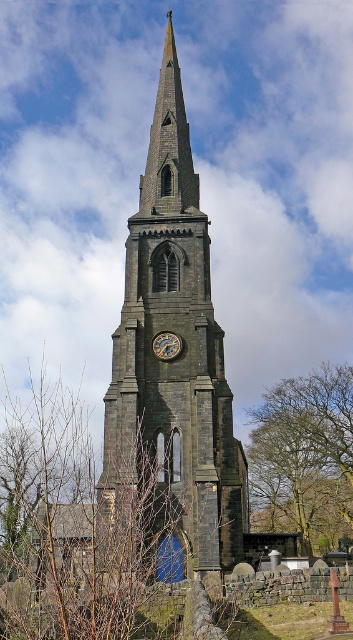
You are standing in front of the Gothic church tower and want to determine the relative positions of two points marked on the tower. Which point is closer to you, point (x=321, y=472) or point (x=165, y=358)?

Point (x=321, y=472) is further to the viewer than point (x=165, y=358), so point (x=165, y=358) is closer to you.

You are standing in front of a Gothic church and want to take a photo of the dark gray stone clock tower at center. To ensure the clock face is clearly visible, where should you position yourself relative to the point marked at coordinate point [181,349]?

You should position yourself directly in front of the point marked at coordinate point [181,349], as that is where the dark gray stone clock tower at center is located, ensuring the clock face will be clearly visible in your photo.

You are standing in front of the dark gray stone clock tower at center and the gold metallic clock at center. Which object is closer to you?

The dark gray stone clock tower at center is closer to you because it is in front of the gold metallic clock at center.